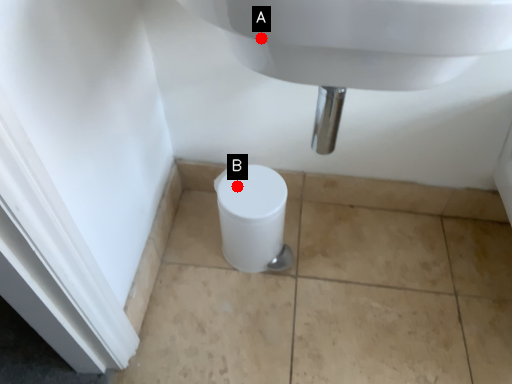
Question: Two points are circled on the image, labeled by A and B beside each circle. Which of the following is the closest to the observer?

Choices:
 (A) A is closer
 (B) B is closer

Answer: (A)